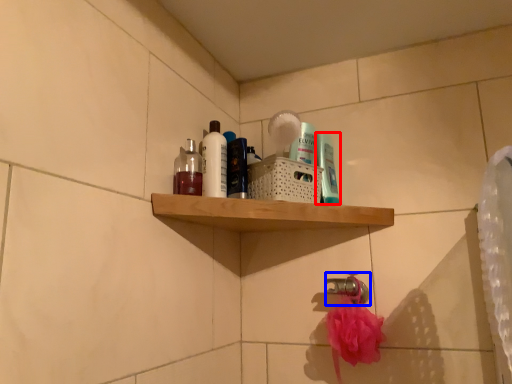
Question: Which point is closer to the camera, mouthwash (highlighted by a red box) or faucet (highlighted by a blue box)?

Choices:
 (A) mouthwash
 (B) faucet

Answer: (A)